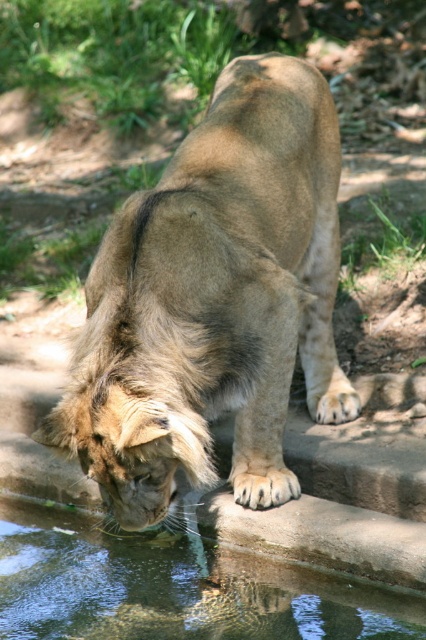
Question: Does golden fur lion at center appear over clear water at mouth?

Choices:
 (A) yes
 (B) no

Answer: (A)

Question: Which of the following is the farthest from the observer?

Choices:
 (A) (209, 266)
 (B) (46, 588)

Answer: (B)

Question: Considering the relative positions of golden fur lion at center and clear water at mouth in the image provided, where is golden fur lion at center located with respect to clear water at mouth?

Choices:
 (A) above
 (B) below

Answer: (A)

Question: Which of the following is the closest to the observer?

Choices:
 (A) clear water at mouth
 (B) golden fur lion at center

Answer: (B)

Question: Is golden fur lion at center further to camera compared to clear water at mouth?

Choices:
 (A) yes
 (B) no

Answer: (B)